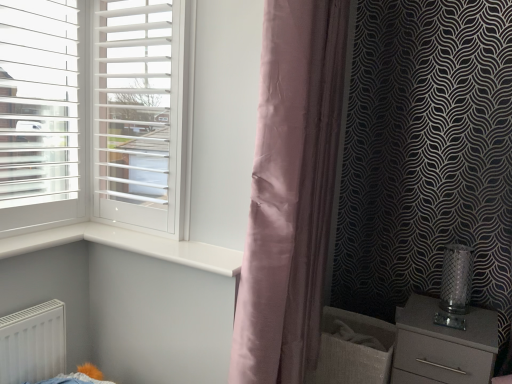
The width and height of the screenshot is (512, 384). What are the coordinates of `empty space that is ontop of white glossy window sill at center (from a real-world perspective)` in the screenshot? It's located at (167, 244).